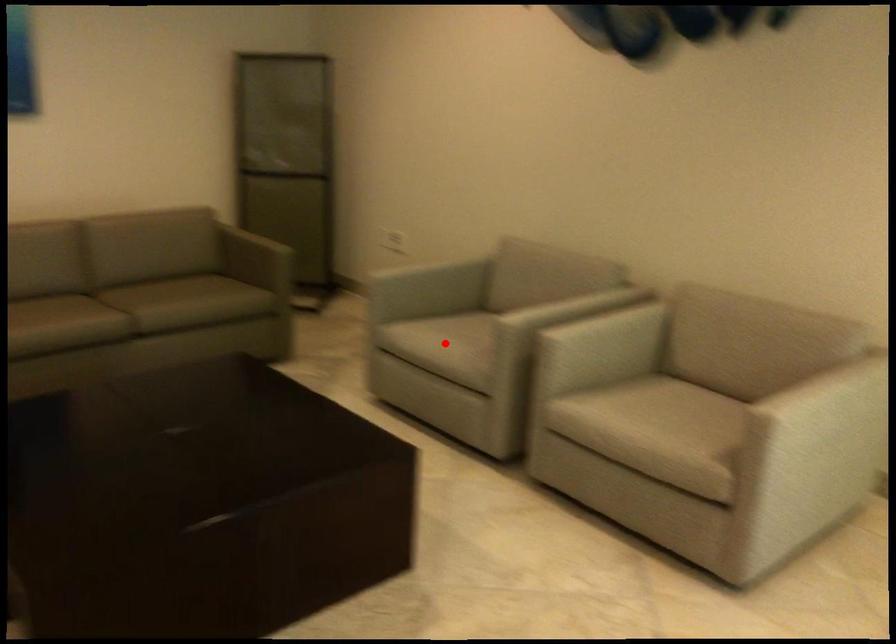
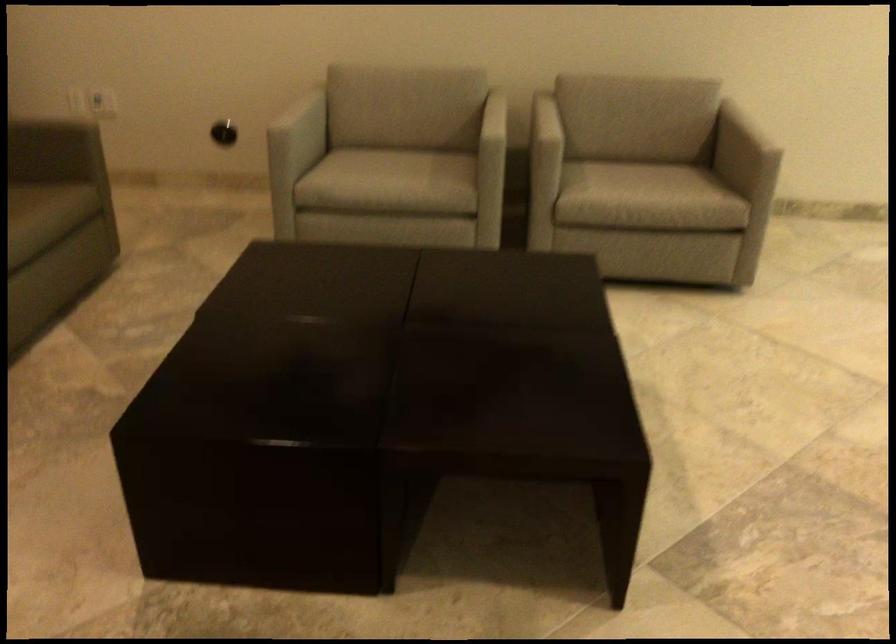
Find the pixel in the second image that matches the highlighted location in the first image.

(390, 176)